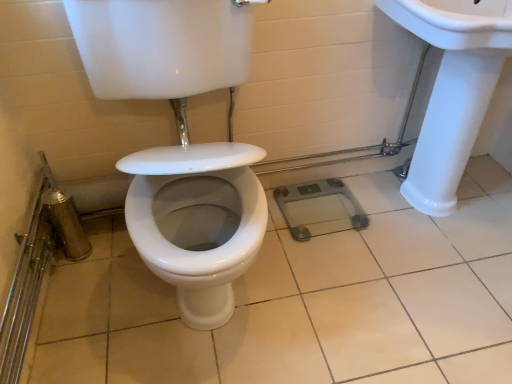
Locate an element on the screen. vacant space in front of white glossy sink at upper right is located at coordinates (437, 295).